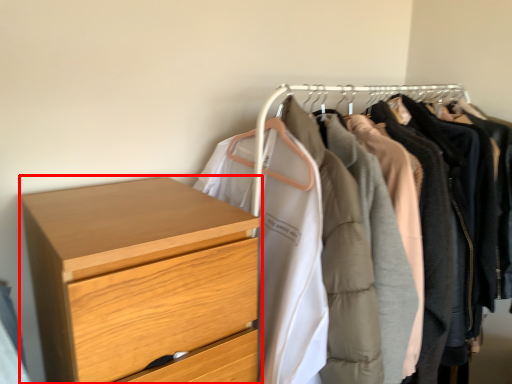
Question: From the image's perspective, where is chest of drawers (annotated by the red box) located in relation to closet in the image?

Choices:
 (A) below
 (B) above

Answer: (A)